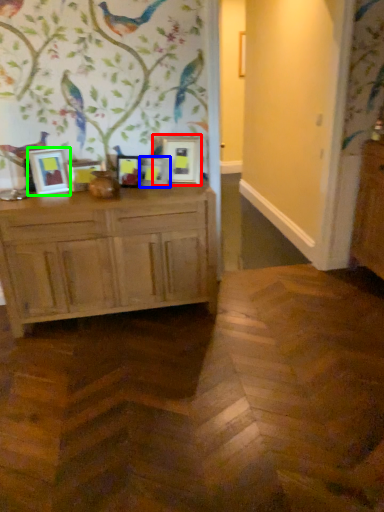
Question: Estimate the real-world distances between objects in this image. Which object is closer to picture frame (highlighted by a red box), picture frame (highlighted by a blue box) or picture frame (highlighted by a green box)?

Choices:
 (A) picture frame
 (B) picture frame

Answer: (A)